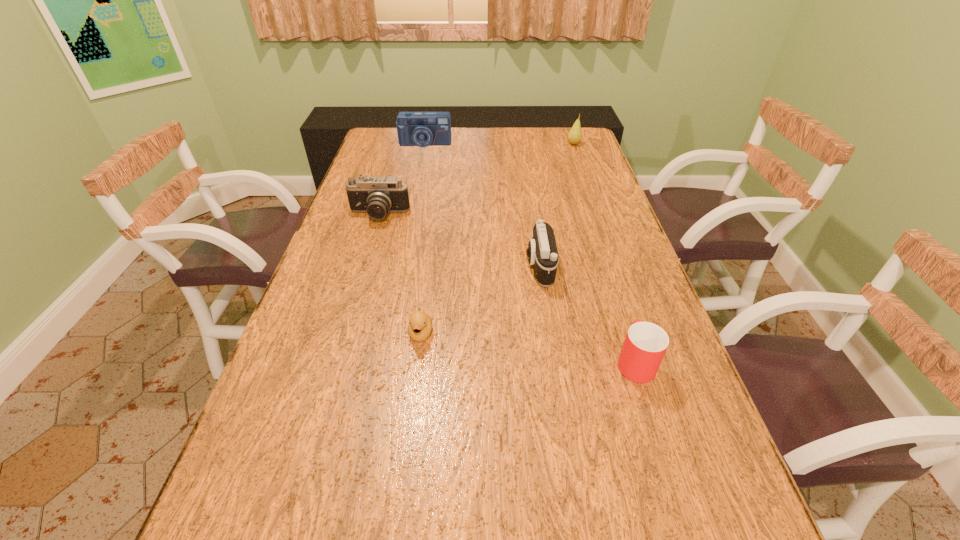
Where is `free point that satisfies the following two spatial constraints: 1. on the side of the pear with the handle; 2. on the left side of the cup`? This screenshot has height=540, width=960. free point that satisfies the following two spatial constraints: 1. on the side of the pear with the handle; 2. on the left side of the cup is located at coordinates 565,144.